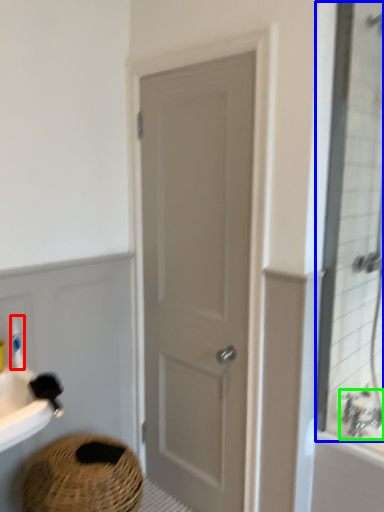
Question: Estimate the real-world distances between objects in this image. Which object is closer to toiletry (highlighted by a red box), mirror (highlighted by a blue box) or tap (highlighted by a green box)?

Choices:
 (A) mirror
 (B) tap

Answer: (B)